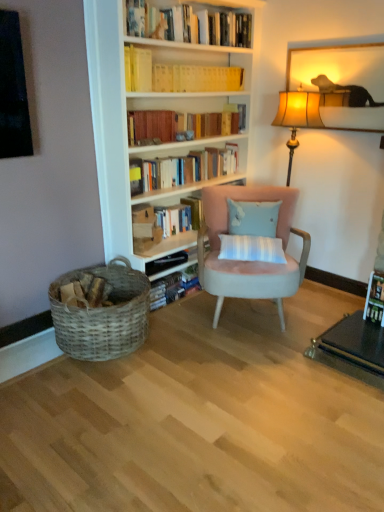
The width and height of the screenshot is (384, 512). Identify the location of free space above wooden picture frame at upper right (from a real-world perspective). (334, 44).